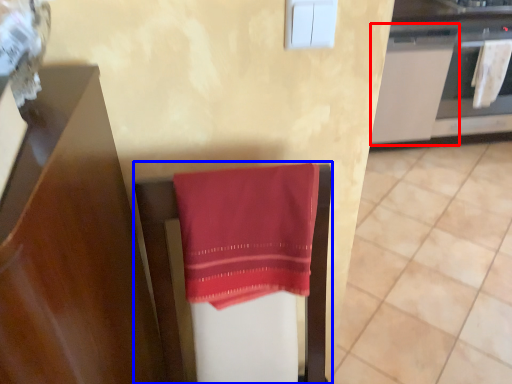
Question: Which point is further to the camera, cabinetry (highlighted by a red box) or furniture (highlighted by a blue box)?

Choices:
 (A) cabinetry
 (B) furniture

Answer: (A)